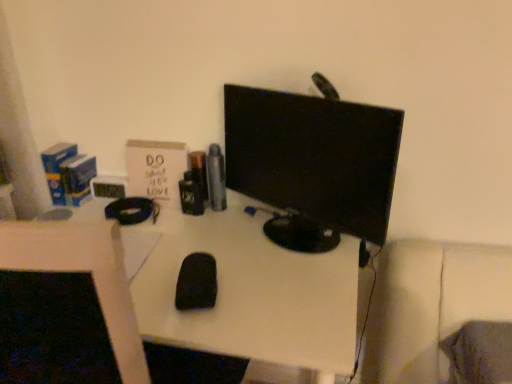
Locate an element on the screen. The height and width of the screenshot is (384, 512). free space in front of black glossy monitor at center is located at coordinates (281, 295).